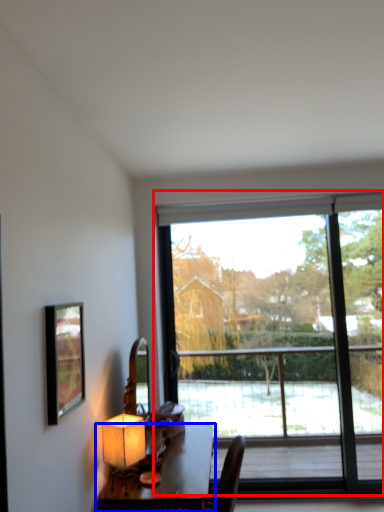
Question: Which object is closer to the camera taking this photo, window (highlighted by a red box) or table (highlighted by a blue box)?

Choices:
 (A) window
 (B) table

Answer: (B)